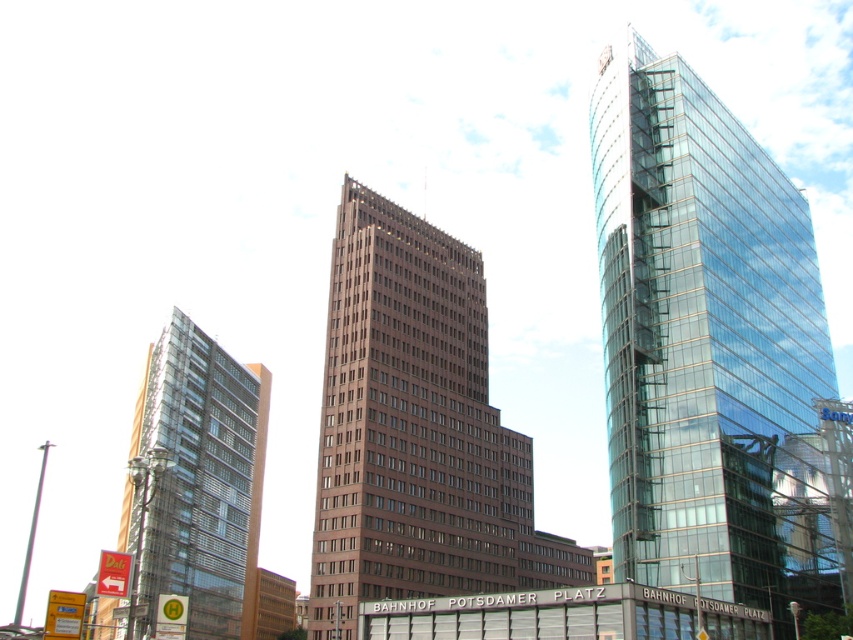
You are standing at the point marked as point (805, 317) in the cityscape. You want to take a photo of the Potsdamer Platz Building, which is the central and tallest building. Considering your current position, will you be able to capture the entire building in your camera frame without moving? Explain your reasoning based on the distance between you and the building.

The distance between you and the Potsdamer Platz Building is 78.61 meters. Since the building is the tallest and centrally located, and you are 78.61 meters away, it is likely that you can capture the entire building in your camera frame as the distance provides a wide enough angle to include its height and width without needing to move.

You are standing in the city looking at the three buildings. You notice two points marked in the image. The first point is at coordinate (318, 476) and the second point is at (260, 397). Which of these two points is nearer to your viewpoint?

Point (318, 476) is closer to the camera than point (260, 397).

You are standing at the central Potsdamer Platz Building and want to look towards the point marked at coordinates point (x=708, y=346). Which building will you see through your line of sight?

→ The point (x=708, y=346) is on the transparent glass tower at right, so you will see the transparent glass tower at right through your line of sight.